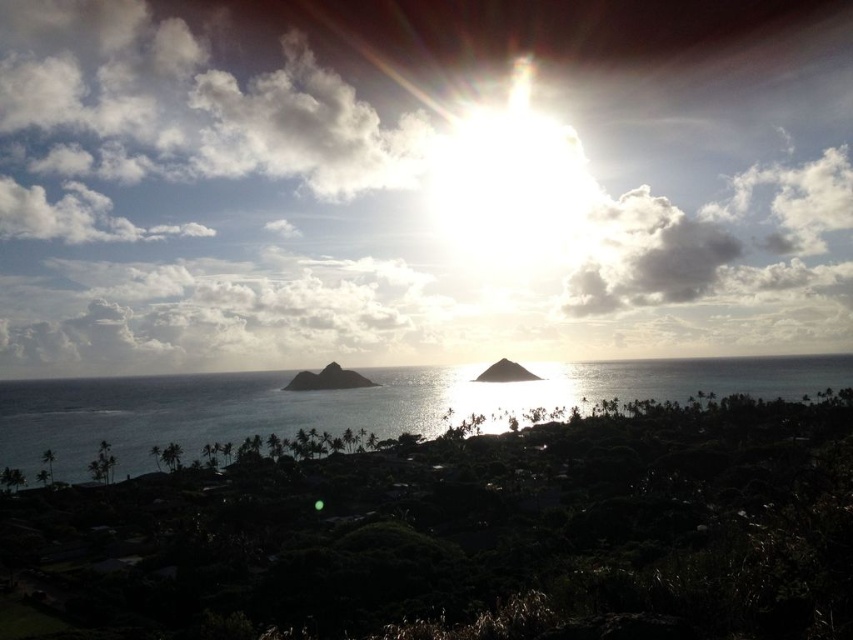
Question: Considering the relative positions of clear blue water at center and dark brown soil at center in the image provided, where is clear blue water at center located with respect to dark brown soil at center?

Choices:
 (A) above
 (B) below

Answer: (B)

Question: Which point is farther to the camera?

Choices:
 (A) (523, 374)
 (B) (224, 388)

Answer: (A)

Question: Which point is farther from the camera taking this photo?

Choices:
 (A) (355, 385)
 (B) (517, 364)
 (C) (1, 422)

Answer: (B)

Question: Is smooth rock island at center smaller than dark brown soil at center?

Choices:
 (A) no
 (B) yes

Answer: (A)

Question: Which point is farther to the camera?

Choices:
 (A) (503, 376)
 (B) (154, 381)
 (C) (317, 378)

Answer: (B)

Question: Can you confirm if clear blue water at center is bigger than smooth rock island at center?

Choices:
 (A) yes
 (B) no

Answer: (A)